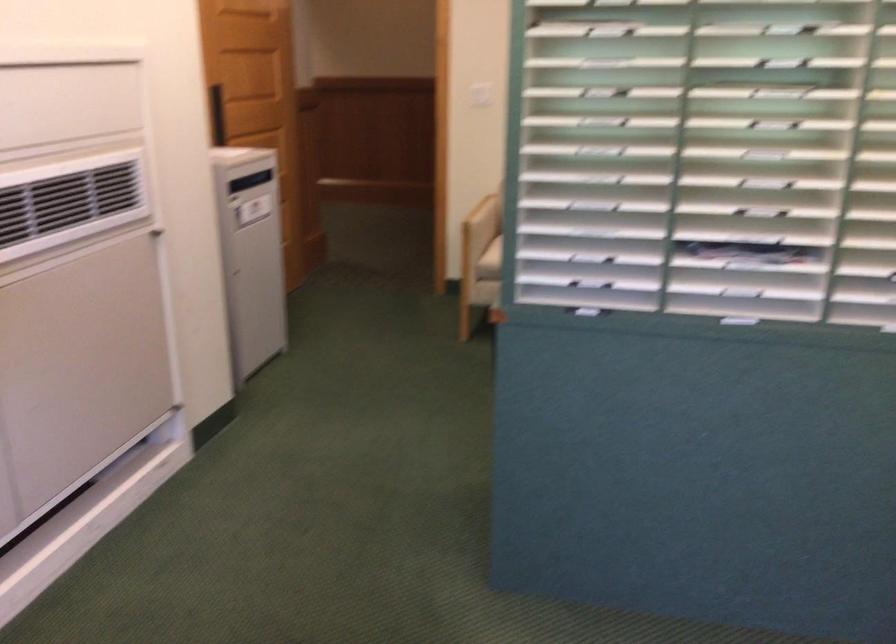
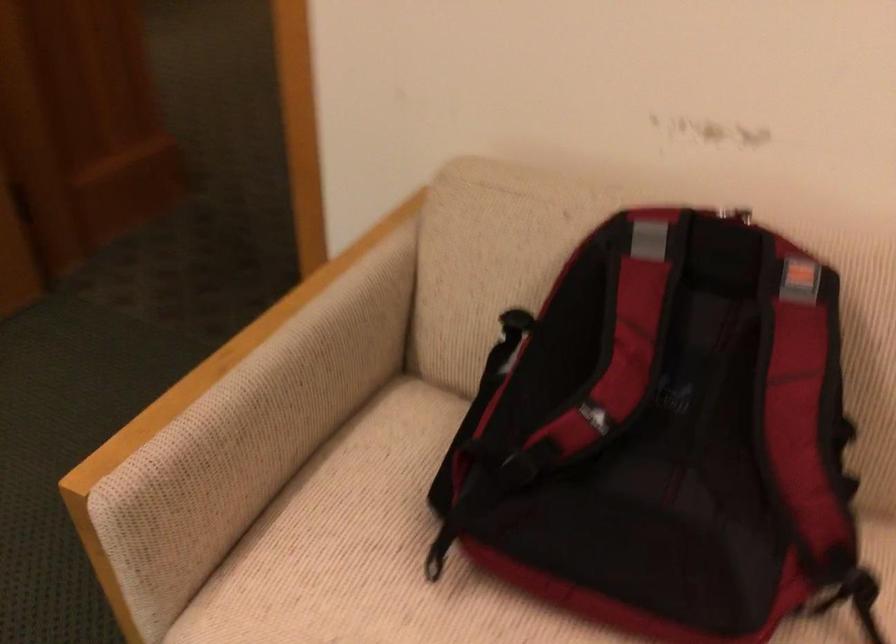
Question: What movement of the cameraman would produce the second image?

Choices:
 (A) Left
 (B) Right
 (C) Forward
 (D) Backward

Answer: (C)